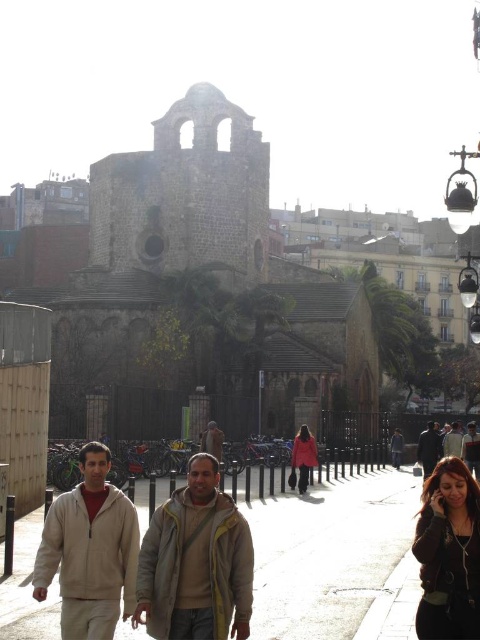
You are standing on the smooth concrete pavement at lower center and want to see the light brown leather jacket at lower right. Can you see it without any obstruction?

The smooth concrete pavement at lower center is taller than light brown leather jacket at lower right, so you cannot see it because the pavement is blocking your view.

You are a delivery person needing to place a 1.2 meter wide package on the smooth concrete pavement at lower center. Can the light brown leather jacket at lower right be placed next to it without overlapping?

The smooth concrete pavement at lower center is wider than the light brown leather jacket at lower right, so yes, the jacket can be placed next to the package without overlapping.